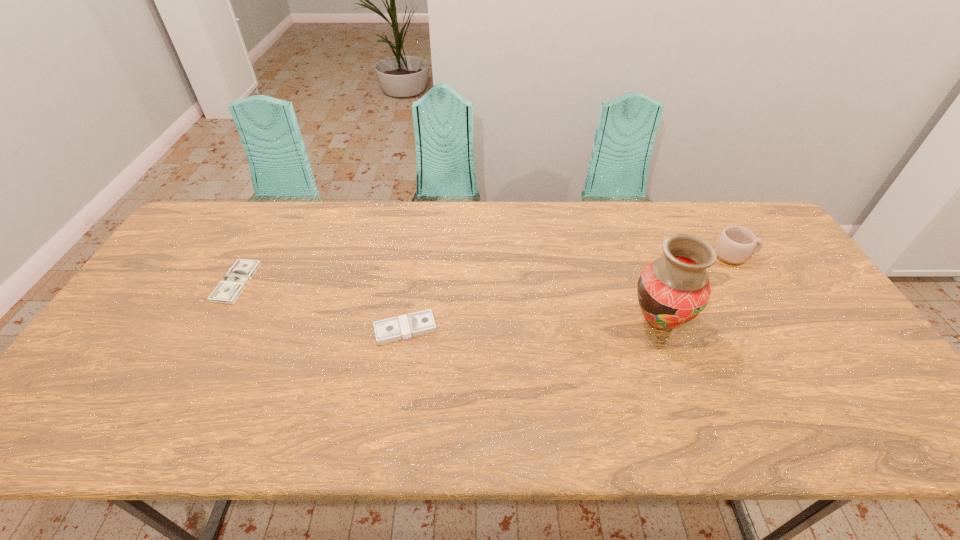
Locate an element on the screen. The width and height of the screenshot is (960, 540). free space in the image that satisfies the following two spatial constraints: 1. on the front side of the left dollar; 2. on the right side of the third object from left to right is located at coordinates (215, 321).

Identify the location of blank area in the image that satisfies the following two spatial constraints: 1. on the side of the third shortest object with the handle; 2. on the front side of the farther dollar. (751, 282).

At what (x,y) coordinates should I click in order to perform the action: click on vacant space that satisfies the following two spatial constraints: 1. on the side of the rightmost object with the handle; 2. on the front side of the taller dollar. Please return your answer as a coordinate pair (x, y). This screenshot has width=960, height=540. Looking at the image, I should click on (779, 328).

This screenshot has height=540, width=960. What are the coordinates of `free point that satisfies the following two spatial constraints: 1. on the side of the rightmost object with the handle; 2. on the front side of the third object from left to right` in the screenshot? It's located at (775, 321).

You are a GUI agent. You are given a task and a screenshot of the screen. Output one action in this format:
    pyautogui.click(x=<x>, y=<y>)
    Task: Click on the free location that satisfies the following two spatial constraints: 1. on the side of the rightmost object with the handle; 2. on the front side of the vase
    The image size is (960, 540).
    Given the screenshot: What is the action you would take?
    click(775, 321)

Identify the location of free space in the image that satisfies the following two spatial constraints: 1. on the front side of the tallest object; 2. on the left side of the farther dollar. (215, 321).